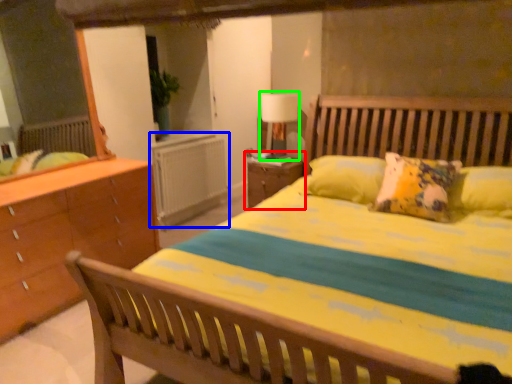
Question: Based on their relative distances, which object is nearer to nightstand (highlighted by a red box)? Choose from radiator (highlighted by a blue box) and table lamp (highlighted by a green box).

Choices:
 (A) radiator
 (B) table lamp

Answer: (B)